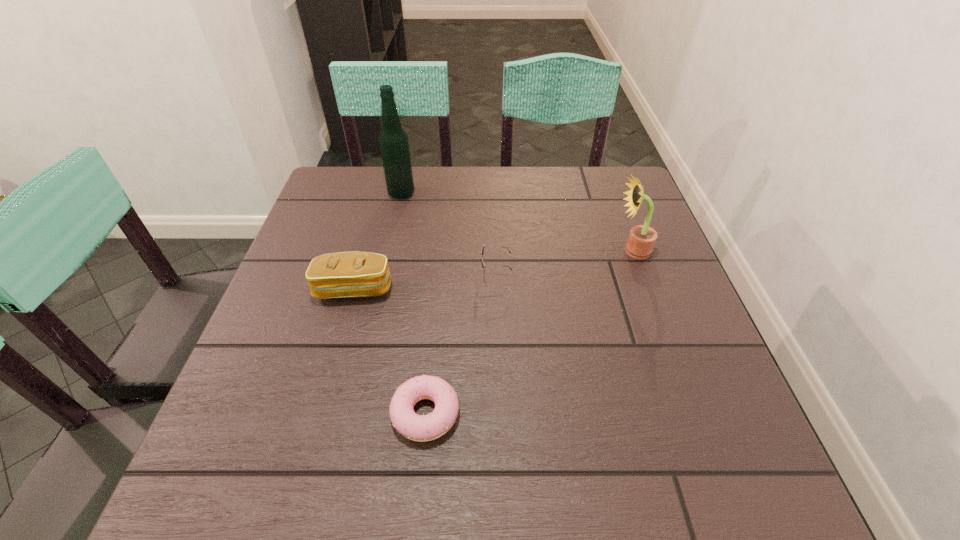
The height and width of the screenshot is (540, 960). What are the coordinates of `vacant space at the far edge` in the screenshot? It's located at (423, 175).

This screenshot has width=960, height=540. Find the location of `free spot at the near edge of the desktop`. free spot at the near edge of the desktop is located at coordinates (476, 503).

In the image, there is a desktop. At what (x,y) coordinates should I click in order to perform the action: click on vacant space at the left edge. Please return your answer as a coordinate pair (x, y). The width and height of the screenshot is (960, 540). Looking at the image, I should click on (310, 408).

The image size is (960, 540). Find the location of `free space at the right edge of the desktop`. free space at the right edge of the desktop is located at coordinates (608, 246).

Locate an element on the screen. blank space at the far left corner of the desktop is located at coordinates (340, 190).

The image size is (960, 540). I want to click on vacant region at the near right corner, so click(x=701, y=487).

The image size is (960, 540). What are the coordinates of `vacant area that lies between the tallest object and the second object from right to left` in the screenshot? It's located at (448, 234).

Find the location of a particular element. The height and width of the screenshot is (540, 960). free space between the doughnut and the sunglasses is located at coordinates (461, 344).

The width and height of the screenshot is (960, 540). What are the coordinates of `vacant space in between the clutch bag and the sunglasses` in the screenshot? It's located at (424, 282).

Image resolution: width=960 pixels, height=540 pixels. In order to click on vacant area that lies between the second object from right to left and the sunflower in this screenshot , I will do `click(564, 262)`.